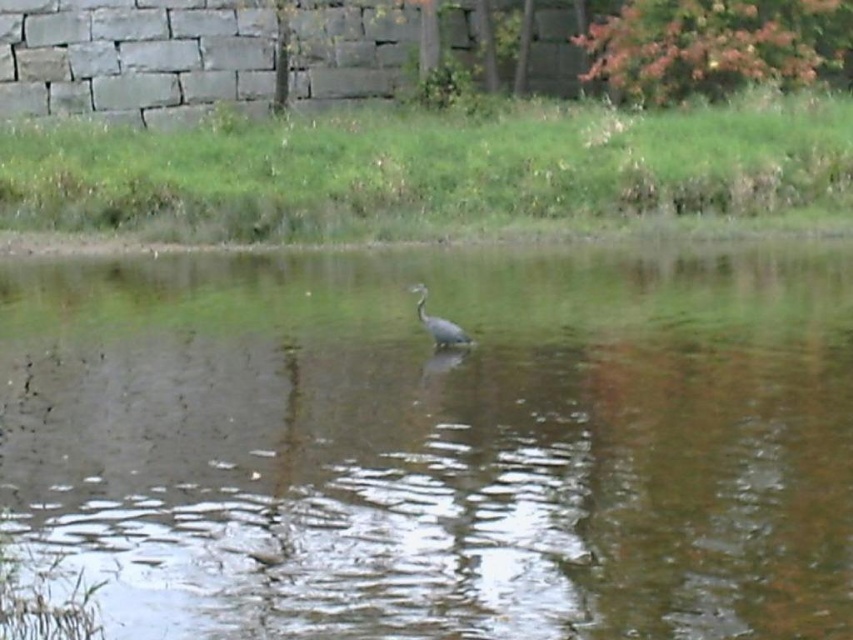
Which of these two, brown murky water at center or gray matte bird at center, stands taller?

Standing taller between the two is brown murky water at center.

Can you confirm if brown murky water at center is shorter than gray matte bird at center?

No, brown murky water at center is not shorter than gray matte bird at center.

Measure the distance between brown murky water at center and camera.

A distance of 19.73 feet exists between brown murky water at center and camera.

The width and height of the screenshot is (853, 640). In order to click on brown murky water at center in this screenshot , I will do `click(440, 442)`.